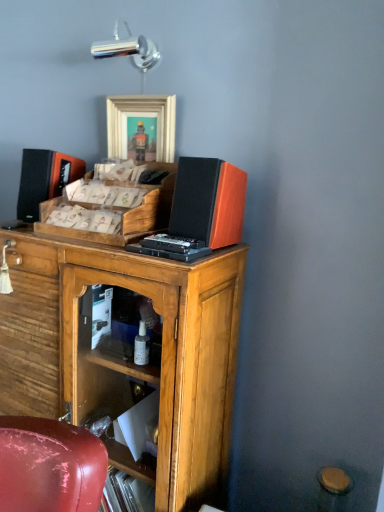
Question: Is wooden picture frame at upper center in front of or behind wooden cabinet at center in the image?

Choices:
 (A) behind
 (B) front

Answer: (A)

Question: From the image's perspective, is wooden picture frame at upper center positioned above or below wooden cabinet at center?

Choices:
 (A) above
 (B) below

Answer: (A)

Question: Which object is the farthest from the wooden picture frame at upper center?

Choices:
 (A) wooden tray at center
 (B) orange matte speaker at upper right
 (C) matte black speaker at upper left
 (D) wooden cabinet at center

Answer: (D)

Question: Estimate the real-world distances between objects in this image. Which object is farther from the wooden cabinet at center?

Choices:
 (A) orange matte speaker at upper right
 (B) wooden picture frame at upper center
 (C) matte black speaker at upper left
 (D) wooden tray at center

Answer: (B)